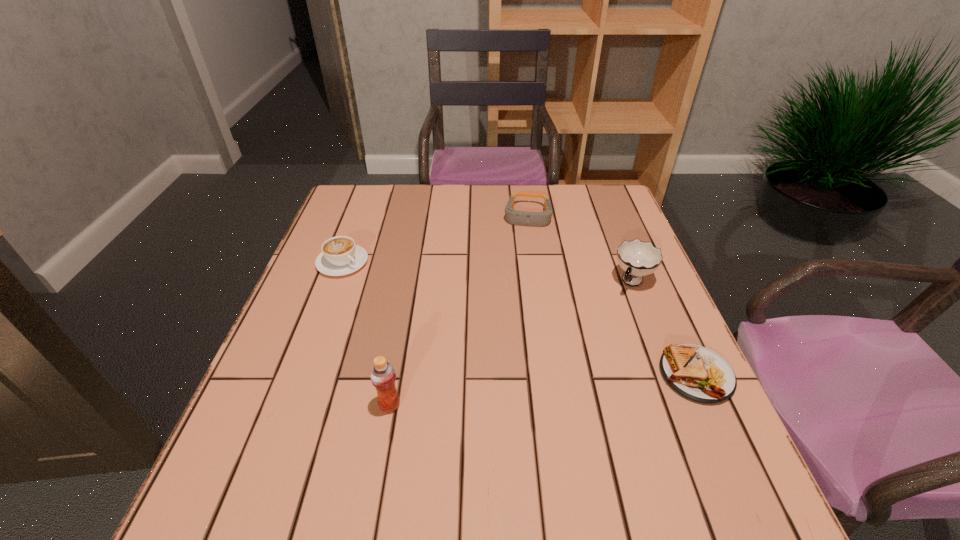
At what (x,y) coordinates should I click in order to perform the action: click on free space between the shortest object and the leftmost object. Please return your answer as a coordinate pair (x, y). The image size is (960, 540). Looking at the image, I should click on (519, 319).

Locate an element on the screen. The width and height of the screenshot is (960, 540). unoccupied area between the leftmost object and the fourth object from right to left is located at coordinates (366, 334).

Identify the location of vacant area between the leftmost object and the orange juice. The width and height of the screenshot is (960, 540). (366, 334).

The width and height of the screenshot is (960, 540). What are the coordinates of `vacant area that lies between the leftmost object and the orange juice` in the screenshot? It's located at (366, 334).

Locate an element on the screen. The height and width of the screenshot is (540, 960). free spot between the leftmost object and the cup is located at coordinates (488, 272).

Find the location of `free area in between the tallest object and the leftmost object`. free area in between the tallest object and the leftmost object is located at coordinates (366, 334).

Image resolution: width=960 pixels, height=540 pixels. In order to click on empty space between the tallest object and the farthest object in this screenshot , I will do `click(458, 310)`.

Where is `vacant region between the leftmost object and the fourth object from right to left`? Image resolution: width=960 pixels, height=540 pixels. vacant region between the leftmost object and the fourth object from right to left is located at coordinates (366, 334).

Identify the location of free spot between the cup and the farthest object. This screenshot has height=540, width=960. (580, 249).

Identify the location of object that stands as the third closest to the fourth shortest object. This screenshot has width=960, height=540. (382, 374).